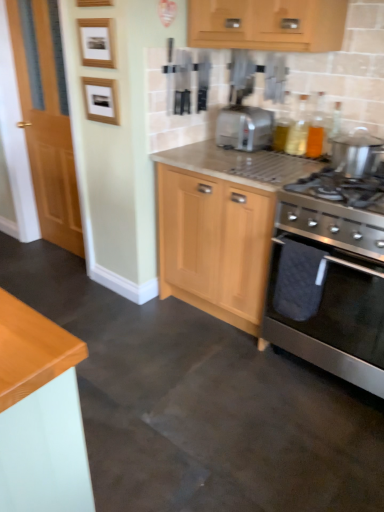
Question: Is light wood cabinet at center inside or outside of wooden picture frame at upper left, which ranks as the second picture frame in bottom-to-top order?

Choices:
 (A) outside
 (B) inside

Answer: (A)

Question: In terms of width, does light wood cabinet at center look wider or thinner when compared to wooden picture frame at upper left, which ranks as the second picture frame in bottom-to-top order?

Choices:
 (A) thin
 (B) wide

Answer: (B)

Question: Which of these objects is positioned closest to the stainless steel gas stove at right?

Choices:
 (A) wooden door at left
 (B) stainless steel oven at lower right
 (C) wooden picture frame at upper left, positioned as the second picture frame in top-to-bottom order
 (D) translucent glass bottle at upper right, the first bottle when ordered from left to right
 (E) translucent glass bottles at upper right, the first bottle from the right

Answer: (B)

Question: Estimate the real-world distances between objects in this image. Which object is farther from the wooden door at left?

Choices:
 (A) translucent glass bottle at upper right, the first bottle when ordered from left to right
 (B) translucent glass bottles at upper right, the first bottle from the right
 (C) stainless steel gas stove at right
 (D) wooden picture frame at upper left, positioned as the second picture frame in top-to-bottom order
 (E) stainless steel oven at lower right

Answer: (E)